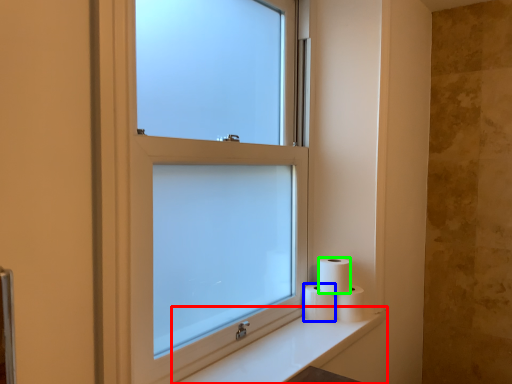
Question: Estimate the real-world distances between objects in this image. Which object is farther from counter top (highlighted by a red box), toilet paper (highlighted by a blue box) or toilet paper (highlighted by a green box)?

Choices:
 (A) toilet paper
 (B) toilet paper

Answer: (B)